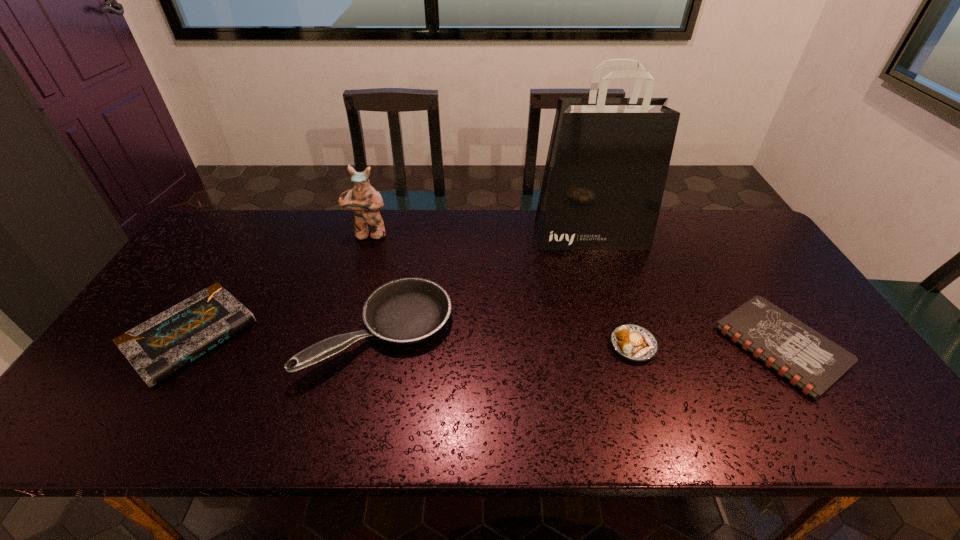
Find the location of `vacant position located 0.260m on the left of the third tallest object`. vacant position located 0.260m on the left of the third tallest object is located at coordinates (211, 332).

Where is `vacant space positioned 0.380m on the right of the pastry`? The width and height of the screenshot is (960, 540). vacant space positioned 0.380m on the right of the pastry is located at coordinates (804, 345).

Locate an element on the screen. This screenshot has height=540, width=960. vacant space situated 0.240m on the back of the left notebook is located at coordinates click(250, 240).

Find the location of a particular element. The height and width of the screenshot is (540, 960). free space located on the back of the shortest object is located at coordinates (712, 236).

Find the location of `shopping bag situated at the far edge`. shopping bag situated at the far edge is located at coordinates (608, 159).

Identify the location of figurine positioned at the far edge. This screenshot has height=540, width=960. (365, 202).

The height and width of the screenshot is (540, 960). In order to click on object that is at the left edge in this screenshot , I will do `click(158, 348)`.

This screenshot has height=540, width=960. I want to click on object present at the right edge, so click(807, 359).

Identify the location of vacant area at the far edge of the desktop. The width and height of the screenshot is (960, 540). [505, 217].

I want to click on vacant space at the near edge, so click(509, 418).